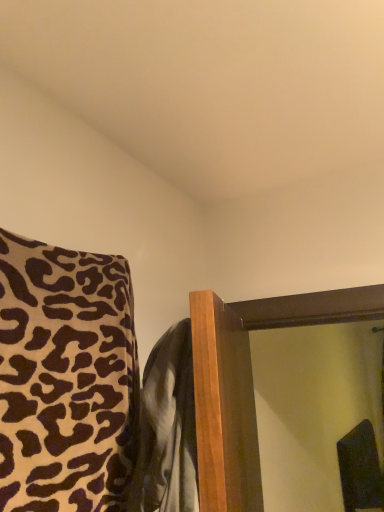
Image resolution: width=384 pixels, height=512 pixels. Describe the element at coordinates (66, 379) in the screenshot. I see `leopard print fabric at left` at that location.

The image size is (384, 512). I want to click on leopard print fabric at left, so click(66, 379).

Identify the location of leopard print fabric at left. (66, 379).